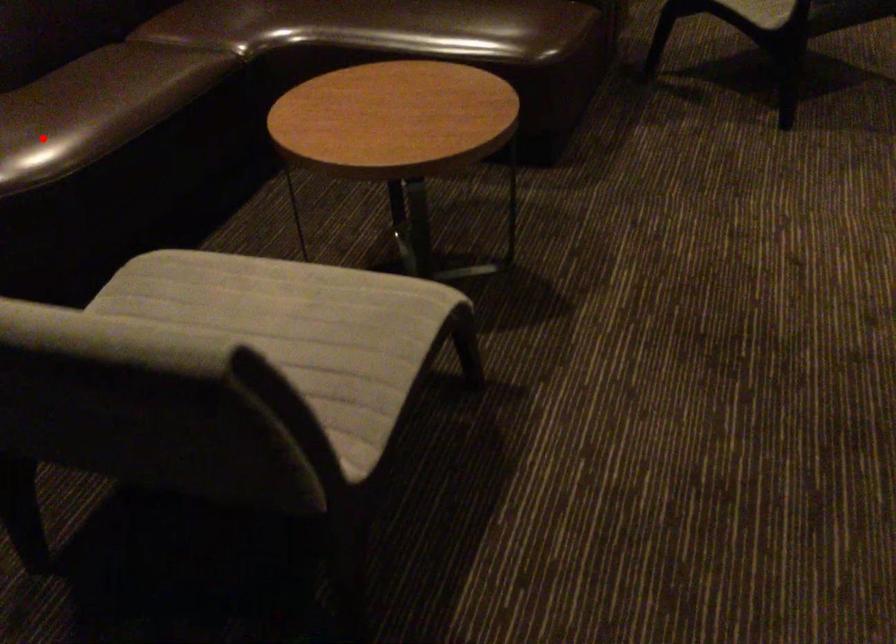
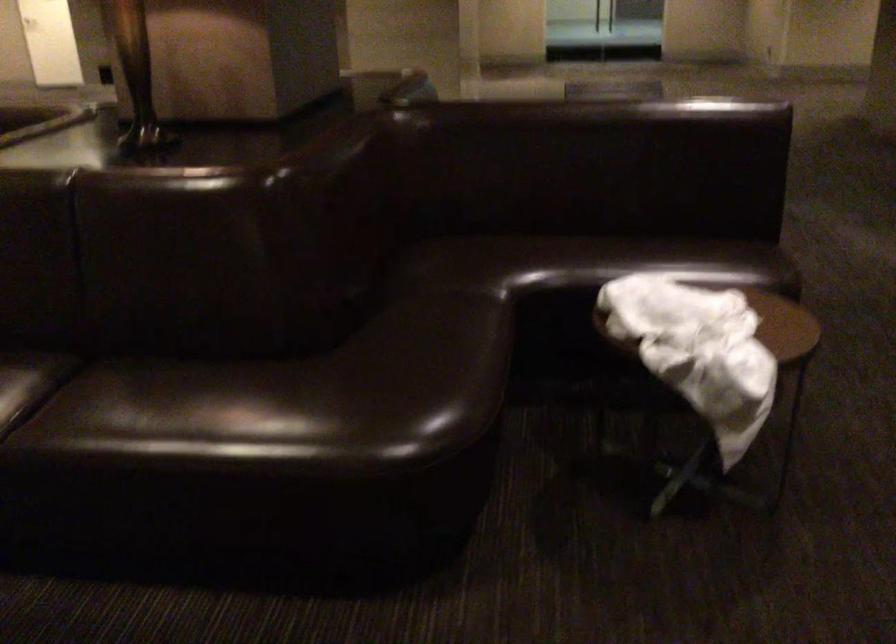
Question: I am providing you with two images of the same scene from different viewpoints. A red point is marked on the first image. At the location where the point appears in image 1, is it still visible in image 2?

Choices:
 (A) Yes
 (B) No

Answer: (B)